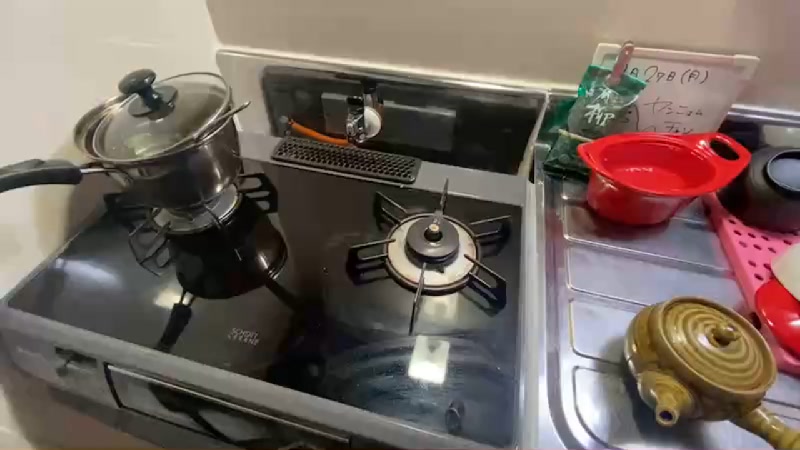
Where is `stove burner`? Image resolution: width=800 pixels, height=450 pixels. stove burner is located at coordinates (465, 238), (224, 205).